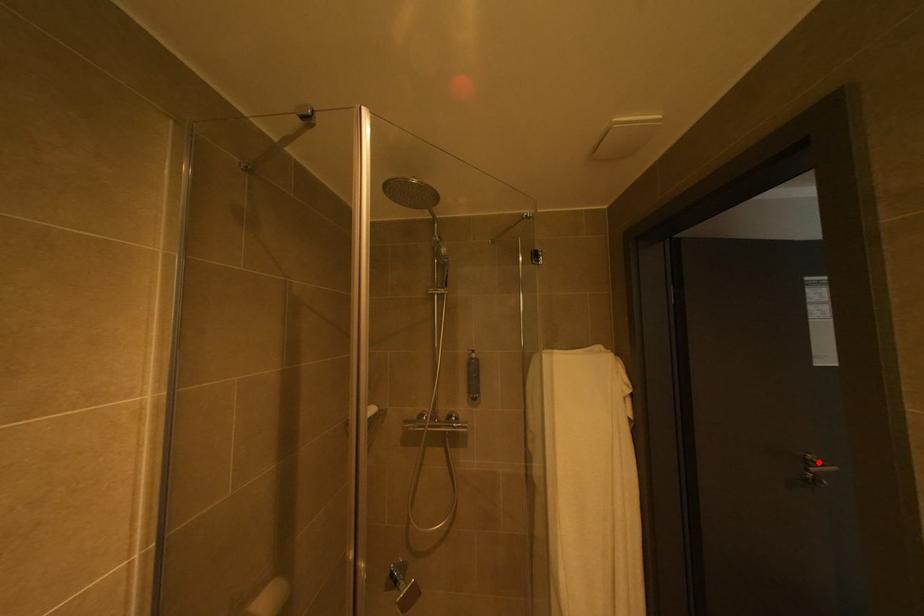
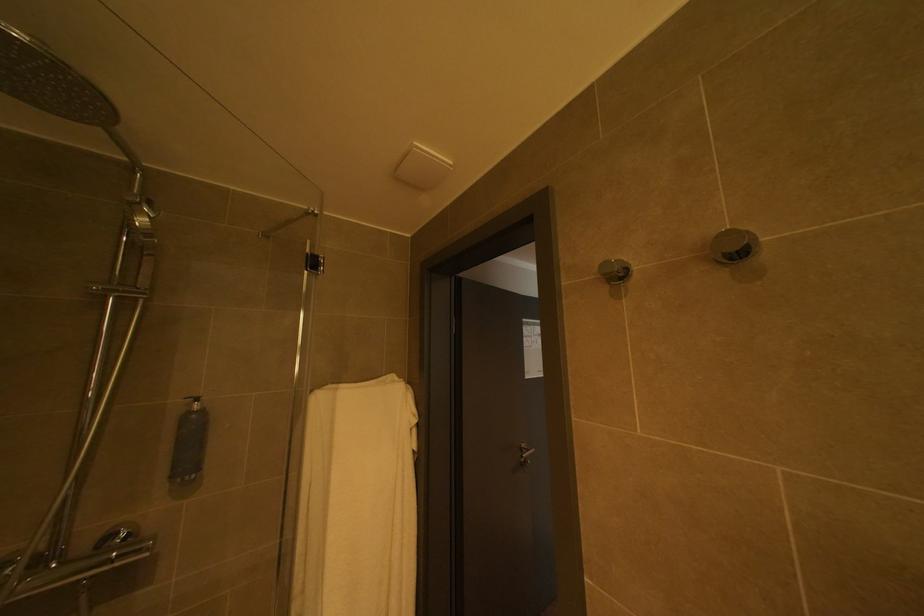
Find the pixel in the second image that matches the highlighted location in the first image.

(533, 450)